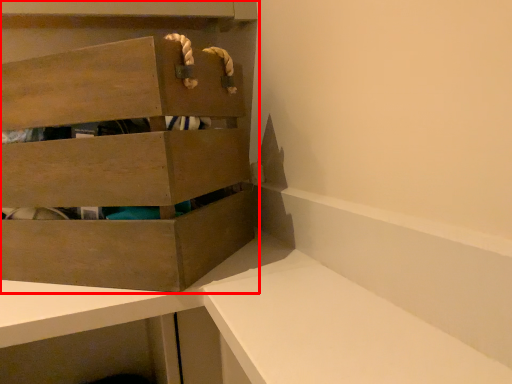
Question: Considering the relative positions of cabinetry (annotated by the red box) and vanity in the image provided, where is cabinetry (annotated by the red box) located with respect to the staircase?

Choices:
 (A) left
 (B) right

Answer: (A)